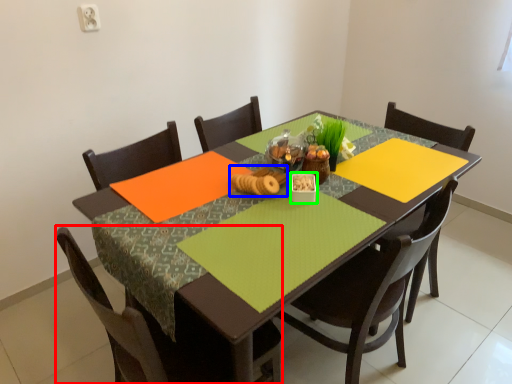
Question: Based on their relative distances, which object is nearer to chair (highlighted by a red box)? Choose from food (highlighted by a blue box) and tableware (highlighted by a green box).

Choices:
 (A) food
 (B) tableware

Answer: (A)